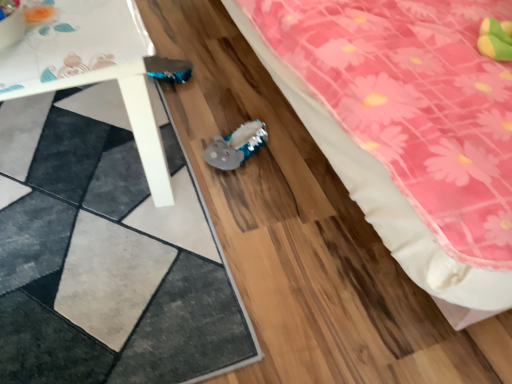
Question: Considering the relative sizes of pink fabric bed at lower right and textured gray rug at lower left in the image provided, is pink fabric bed at lower right bigger than textured gray rug at lower left?

Choices:
 (A) no
 (B) yes

Answer: (B)

Question: Is pink fabric bed at lower right oriented away from textured gray rug at lower left?

Choices:
 (A) no
 (B) yes

Answer: (A)

Question: Does pink fabric bed at lower right have a smaller size compared to textured gray rug at lower left?

Choices:
 (A) no
 (B) yes

Answer: (A)

Question: Is pink fabric bed at lower right to the right of textured gray rug at lower left from the viewer's perspective?

Choices:
 (A) no
 (B) yes

Answer: (B)

Question: From a real-world perspective, is pink fabric bed at lower right positioned over textured gray rug at lower left based on gravity?

Choices:
 (A) yes
 (B) no

Answer: (A)

Question: Do you think textured gray rug at lower left is within pink fabric bed at lower right, or outside of it?

Choices:
 (A) inside
 (B) outside

Answer: (B)

Question: From a real-world perspective, relative to pink fabric bed at lower right, is textured gray rug at lower left vertically above or below?

Choices:
 (A) below
 (B) above

Answer: (A)

Question: From the image's perspective, relative to pink fabric bed at lower right, is textured gray rug at lower left above or below?

Choices:
 (A) above
 (B) below

Answer: (B)

Question: Is textured gray rug at lower left wider or thinner than pink fabric bed at lower right?

Choices:
 (A) wide
 (B) thin

Answer: (A)

Question: Is point (386, 180) positioned closer to the camera than point (16, 264)?

Choices:
 (A) closer
 (B) farther

Answer: (A)

Question: Relative to textured gray rug at lower left, is pink fabric bed at lower right in front or behind?

Choices:
 (A) front
 (B) behind

Answer: (A)

Question: In the image, is pink fabric bed at lower right on the left side or the right side of textured gray rug at lower left?

Choices:
 (A) left
 (B) right

Answer: (B)

Question: From a real-world perspective, is pink fabric bed at lower right above or below textured gray rug at lower left?

Choices:
 (A) above
 (B) below

Answer: (A)

Question: Looking at their shapes, would you say textured gray rug at lower left is wider or thinner than white plastic table at lower left?

Choices:
 (A) wide
 (B) thin

Answer: (A)

Question: Visually, is textured gray rug at lower left positioned to the left or to the right of white plastic table at lower left?

Choices:
 (A) right
 (B) left

Answer: (A)